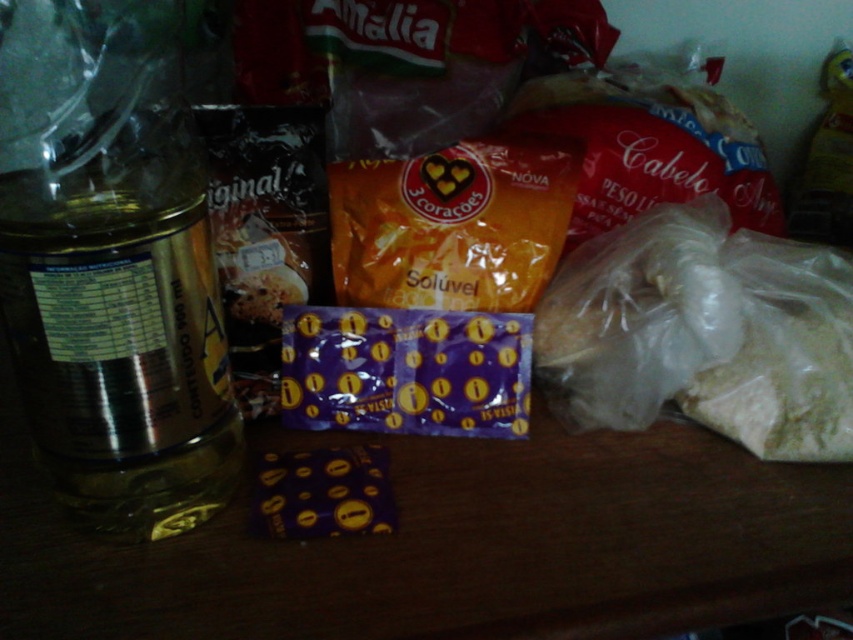
Looking at this image, you are organizing items on a shelf and need to place the metallic gold bottle at left and the orange matte packet at center. According to the image, which item should be placed to the right side of the other?

The metallic gold bottle at left is positioned on the left side of orange matte packet at center, so the orange matte packet at center should be placed to the right of the metallic gold bottle at left.

You are standing in front of the wooden surface with the food items. There is a point marked at coordinates (112,266). Which object is this point located on?

The point at (112,266) is located on the metallic gold bottle at left.

You are organizing items on a table and need to place a new item between the white powder at right and the orange matte packet at center. Based on their current positions, where should you position the new item?

Since the white powder at right is to the right of the orange matte packet at center, you should place the new item between them by positioning it to the right of the orange matte packet at center and to the left of the white powder at right.